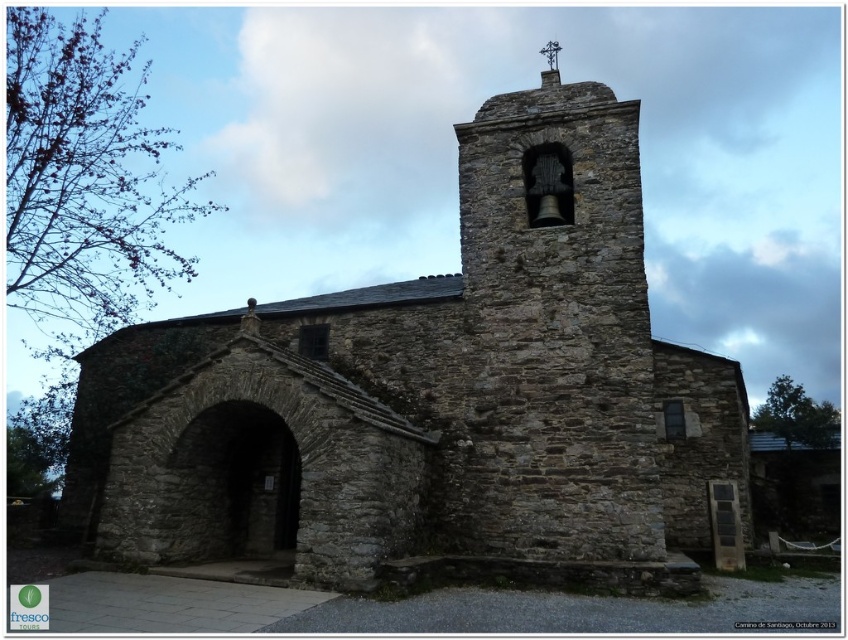
Does rustic stone church at center appear on the right side of rustic stone bell tower at center?

No, rustic stone church at center is not to the right of rustic stone bell tower at center.

This screenshot has width=848, height=640. I want to click on rustic stone church at center, so click(433, 396).